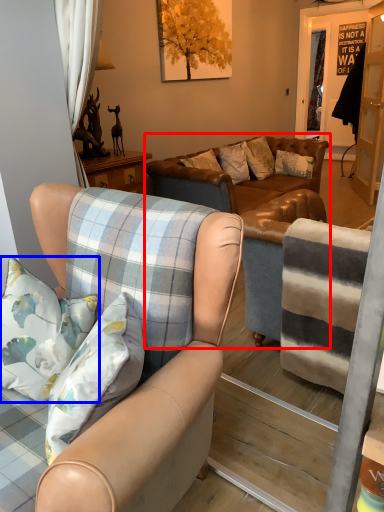
Question: Which object appears closest to the camera in this image, studio couch (highlighted by a red box) or pillow (highlighted by a blue box)?

Choices:
 (A) studio couch
 (B) pillow

Answer: (B)